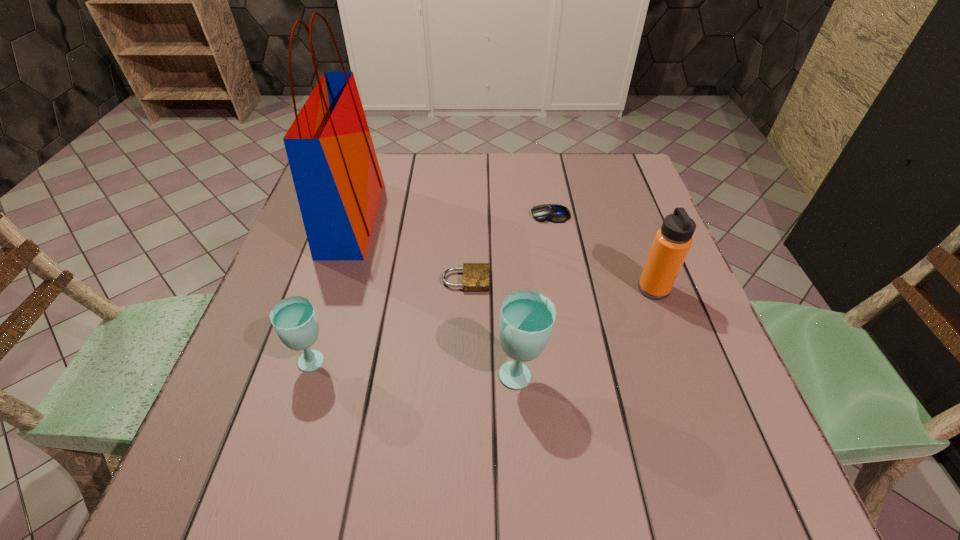
Find the location of a particular element. This screenshot has height=540, width=960. glass that is positioned at the left edge is located at coordinates (294, 320).

This screenshot has width=960, height=540. I want to click on shopping bag at the left edge, so click(336, 174).

Identify the location of object that is at the right edge. (672, 242).

The height and width of the screenshot is (540, 960). What are the coordinates of `object that is positioned at the far left corner` in the screenshot? It's located at (336, 174).

In the image, there is a desktop. Where is `vacant space at the far edge`? Image resolution: width=960 pixels, height=540 pixels. vacant space at the far edge is located at coordinates (570, 153).

Locate an element on the screen. Image resolution: width=960 pixels, height=540 pixels. free space at the near edge of the desktop is located at coordinates (592, 407).

In the image, there is a desktop. Where is `vacant space at the right edge`? vacant space at the right edge is located at coordinates (639, 261).

Identify the location of vacant space at the far right corner of the desktop. The height and width of the screenshot is (540, 960). (598, 170).

Where is `empty space that is in between the computer mouse and the shortest object`? The image size is (960, 540). empty space that is in between the computer mouse and the shortest object is located at coordinates (508, 247).

This screenshot has width=960, height=540. I want to click on vacant space in between the tallest object and the rightmost object, so click(503, 254).